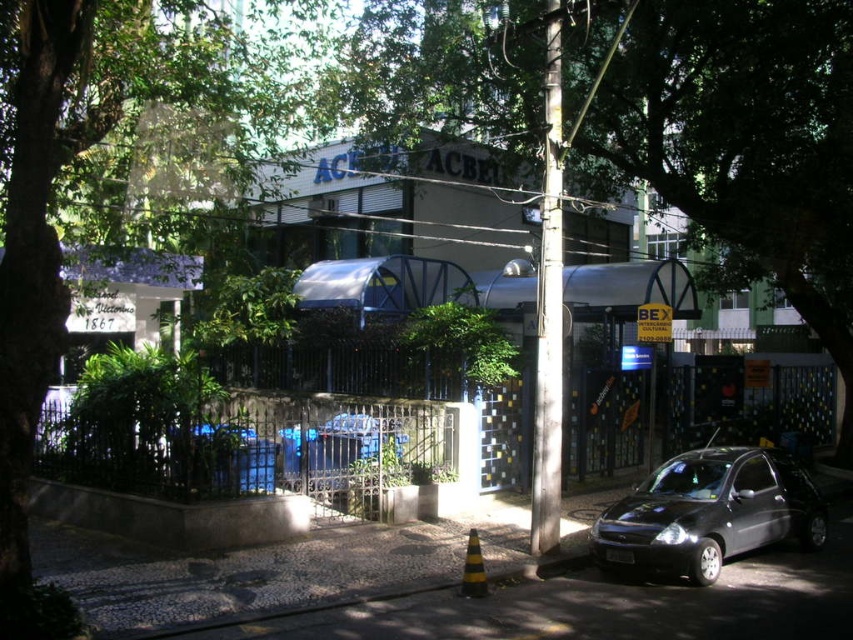
Question: Which object is the closest to the matte black car at lower right?

Choices:
 (A) green leafy tree at center
 (B) green leafy tree at left

Answer: (B)

Question: Which of these objects is positioned farthest from the green leafy tree at center?

Choices:
 (A) matte black car at lower right
 (B) green leafy tree at left

Answer: (A)

Question: Which object is the closest to the matte black car at lower right?

Choices:
 (A) green leafy tree at left
 (B) green leafy tree at center

Answer: (A)

Question: Does green leafy tree at center have a lesser width compared to matte black car at lower right?

Choices:
 (A) no
 (B) yes

Answer: (A)

Question: Is the position of green leafy tree at center more distant than that of matte black car at lower right?

Choices:
 (A) yes
 (B) no

Answer: (A)

Question: Does green leafy tree at left appear over matte black car at lower right?

Choices:
 (A) yes
 (B) no

Answer: (A)